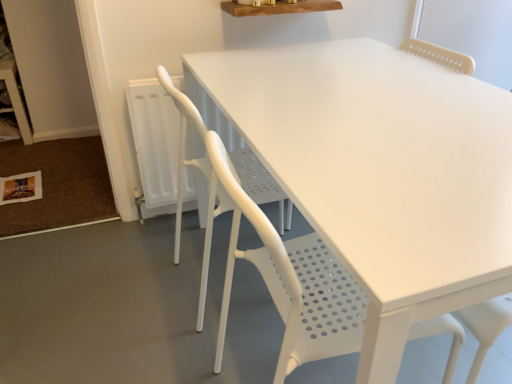
Question: Which direction should I rotate to look at white matte chair at center, the first chair positioned from the front?

Choices:
 (A) right
 (B) left

Answer: (A)

Question: From the image's perspective, does white perforated chair at center, which is counted as the first chair, starting from the back, appear lower than white matte chair at center, the 2th chair from the back?

Choices:
 (A) yes
 (B) no

Answer: (B)

Question: From a real-world perspective, is white perforated chair at center, positioned as the second chair in front-to-back order, physically above white matte chair at center, the first chair positioned from the front?

Choices:
 (A) no
 (B) yes

Answer: (B)

Question: Can you confirm if white perforated chair at center, which is counted as the first chair, starting from the back, is smaller than white matte chair at center, the first chair positioned from the front?

Choices:
 (A) yes
 (B) no

Answer: (B)

Question: Considering the relative sizes of white perforated chair at center, positioned as the second chair in front-to-back order, and white matte chair at center, the 2th chair from the back, in the image provided, is white perforated chair at center, positioned as the second chair in front-to-back order, taller than white matte chair at center, the 2th chair from the back,?

Choices:
 (A) no
 (B) yes

Answer: (A)

Question: Is white perforated chair at center, which is counted as the first chair, starting from the back, turned away from white matte chair at center, the first chair positioned from the front?

Choices:
 (A) no
 (B) yes

Answer: (A)

Question: Is white matte chair at center, the first chair positioned from the front, turned away from white perforated chair at center, positioned as the second chair in front-to-back order?

Choices:
 (A) yes
 (B) no

Answer: (B)

Question: Does white matte chair at center, the first chair positioned from the front, appear on the right side of white perforated chair at center, which is counted as the first chair, starting from the back?

Choices:
 (A) yes
 (B) no

Answer: (A)

Question: Considering the relative sizes of white matte chair at center, the first chair positioned from the front, and white perforated chair at center, which is counted as the first chair, starting from the back, in the image provided, is white matte chair at center, the first chair positioned from the front, taller than white perforated chair at center, which is counted as the first chair, starting from the back,?

Choices:
 (A) yes
 (B) no

Answer: (A)

Question: Is white matte chair at center, the 2th chair from the back, closer to the viewer compared to white perforated chair at center, positioned as the second chair in front-to-back order?

Choices:
 (A) no
 (B) yes

Answer: (B)

Question: Considering the relative sizes of white matte chair at center, the first chair positioned from the front, and white perforated chair at center, which is counted as the first chair, starting from the back, in the image provided, is white matte chair at center, the first chair positioned from the front, thinner than white perforated chair at center, which is counted as the first chair, starting from the back,?

Choices:
 (A) no
 (B) yes

Answer: (B)

Question: Can you confirm if white matte chair at center, the 2th chair from the back, is positioned to the left of white perforated chair at center, positioned as the second chair in front-to-back order?

Choices:
 (A) no
 (B) yes

Answer: (A)

Question: Relative to white perforated chair at center, positioned as the second chair in front-to-back order, is white matte chair at center, the 2th chair from the back, in front or behind?

Choices:
 (A) front
 (B) behind

Answer: (A)